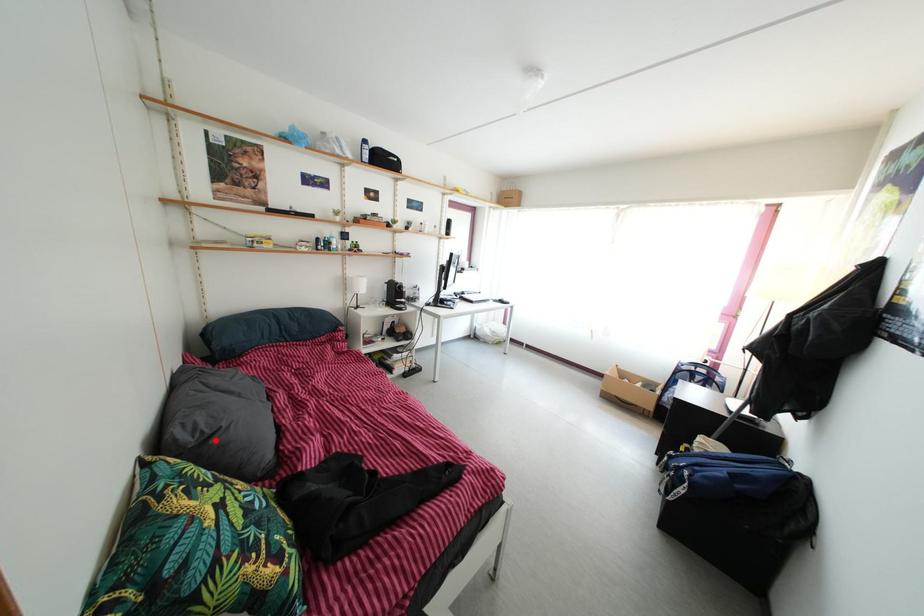
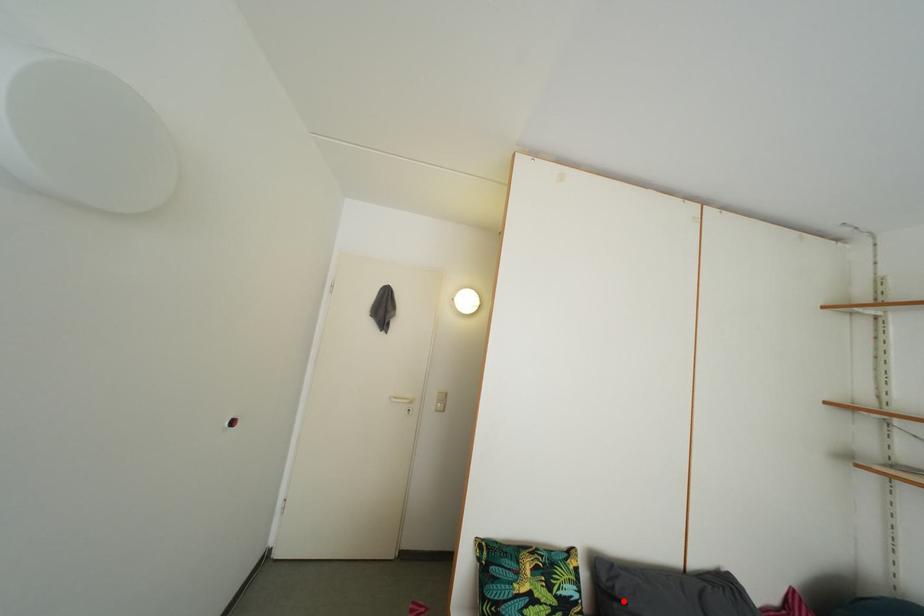
I am providing you with two images of the same scene from different viewpoints. A red point is marked on the first image and another point is marked on the second image. Is the red point in image1 aligned with the point shown in image2?

Yes